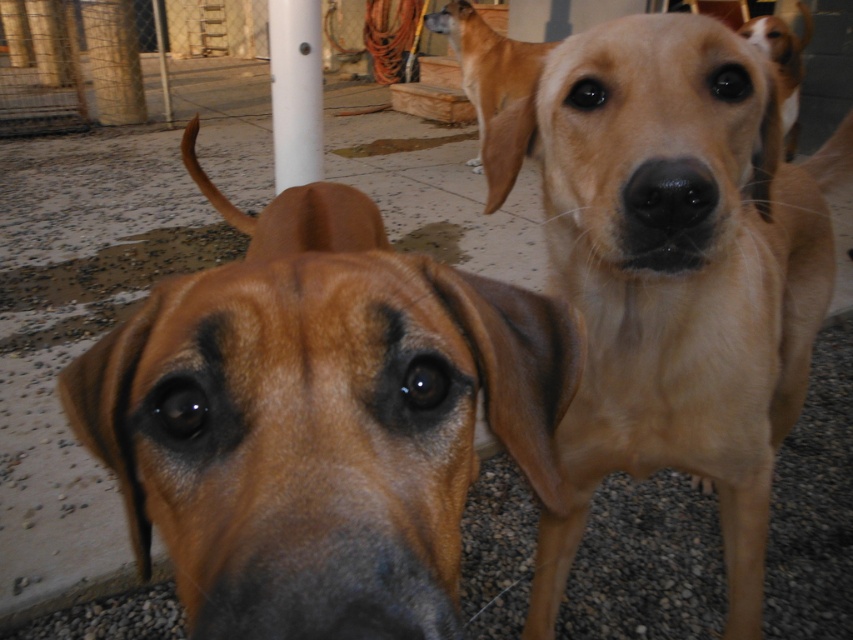
Can you confirm if brown matte dog at center is positioned below light brown fur at center?

Correct, brown matte dog at center is located below light brown fur at center.

Does brown matte dog at center come behind light brown fur at center?

No.

You are a GUI agent. You are given a task and a screenshot of the screen. Output one action in this format:
    pyautogui.click(x=<x>, y=<y>)
    Task: Click on the brown matte dog at center
    
    Given the screenshot: What is the action you would take?
    pyautogui.click(x=318, y=419)

You are a GUI agent. You are given a task and a screenshot of the screen. Output one action in this format:
    pyautogui.click(x=<x>, y=<y>)
    Task: Click on the brown matte dog at center
    
    Given the screenshot: What is the action you would take?
    pyautogui.click(x=318, y=419)

Is white smooth pole at center to the right of black smooth nose at center from the viewer's perspective?

In fact, white smooth pole at center is to the left of black smooth nose at center.

Is point (303, 102) in front of point (677, 193)?

No, it is behind (677, 193).

You are a GUI agent. You are given a task and a screenshot of the screen. Output one action in this format:
    pyautogui.click(x=<x>, y=<y>)
    Task: Click on the white smooth pole at center
    The image size is (853, 640).
    Given the screenshot: What is the action you would take?
    pyautogui.click(x=294, y=90)

Does brown matte dog at center have a smaller size compared to white smooth pole at center?

Correct, brown matte dog at center occupies less space than white smooth pole at center.

The width and height of the screenshot is (853, 640). What do you see at coordinates (318, 419) in the screenshot?
I see `brown matte dog at center` at bounding box center [318, 419].

I want to click on brown matte dog at center, so [318, 419].